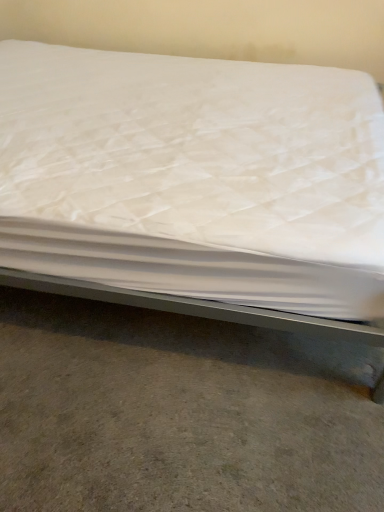
The width and height of the screenshot is (384, 512). Identify the location of blank space above gray concrete floor at lower center (from a real-world perspective). (157, 399).